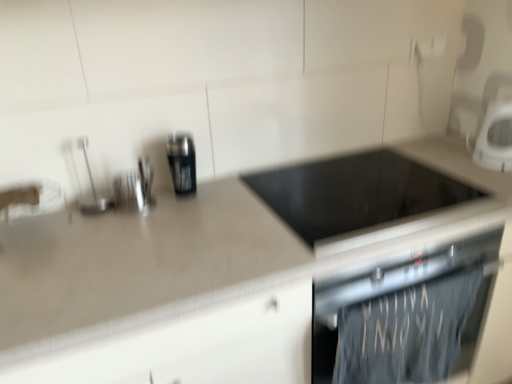
Where is `vacant area on top of black glass cooktop at center, positioned as the third appliance in left-to-right order (from a real-world perspective)`? This screenshot has height=384, width=512. vacant area on top of black glass cooktop at center, positioned as the third appliance in left-to-right order (from a real-world perspective) is located at coordinates (358, 180).